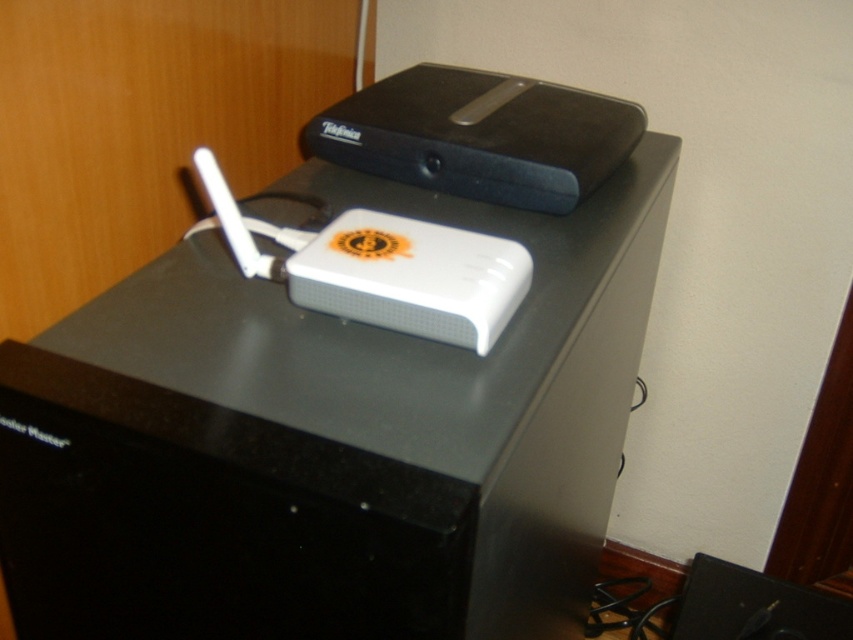
You are setting up a home office and need to place a new keyboard between the white plastic router at center and the black plastic speaker at lower right. The keyboard requires a space of 40 cm between the two devices. Can you determine if there is enough space between them?

The white plastic router at center is closer to the viewer than the black plastic speaker at lower right, so the distance between them may vary depending on their actual positions. However, since the exact distance isn not provided in the description, we cannot confirm if the 40 cm space is available.

You are setting up a home office and need to place the white plastic router at center and the black plastic speaker at lower right on a shelf. The shelf has a height limit of 12 centimeters. Can both items fit vertically without exceeding the height limit?

The white plastic router at center is taller than the black plastic speaker at lower right. Since the shelf has a height limit of 12 centimeters, we need to know the exact heights of both items to determine if they fit. However, the description only states their relative height, not specific measurements. Therefore, it is uncertain if both will fit without exceeding the limit.